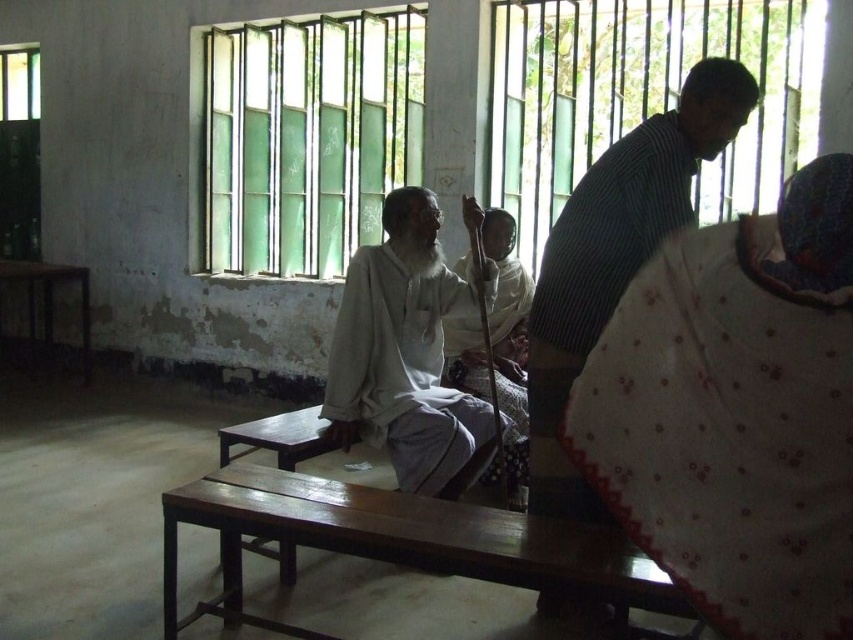
Based on the photo, is white dotted fabric at lower right further to camera compared to light gray fabric at center?

No, it is in front of light gray fabric at center.

Who is more forward, (636, 284) or (426, 440)?

Point (636, 284) is in front.

Identify the location of white dotted fabric at lower right. (728, 432).

Where is `white dotted fabric at lower right`? white dotted fabric at lower right is located at coordinates (728, 432).

Is wooden bench at center positioned in front of light gray fabric at center?

That is True.

Between point (334, 497) and point (468, 394), which one is positioned in front?

Point (334, 497) is in front.

Is point (306, 484) less distant than point (457, 486)?

Yes.

At what (x,y) coordinates should I click in order to perform the action: click on wooden bench at center. Please return your answer as a coordinate pair (x, y). Looking at the image, I should click on (396, 541).

Which is below, wooden bench at center or white cotton robe at center?

wooden bench at center

Based on the photo, can you confirm if wooden bench at center is smaller than white cotton robe at center?

No.

You are a GUI agent. You are given a task and a screenshot of the screen. Output one action in this format:
    pyautogui.click(x=<x>, y=<y>)
    Task: Click on the wooden bench at center
    The height and width of the screenshot is (640, 853).
    Given the screenshot: What is the action you would take?
    pyautogui.click(x=396, y=541)

I want to click on wooden bench at center, so click(x=396, y=541).